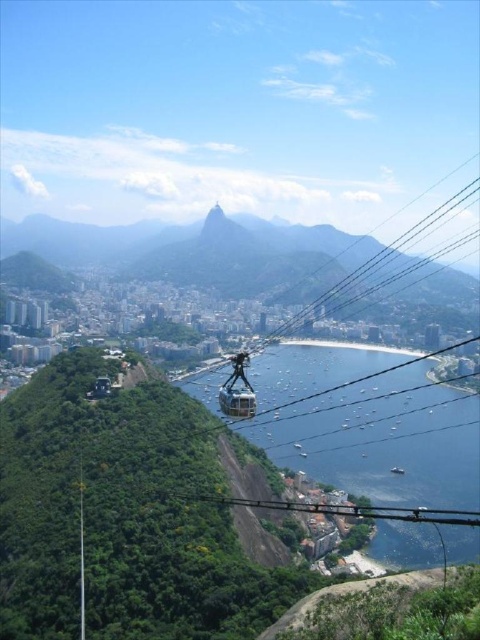
Does green grassy mountain at center have a lesser width compared to metallic cable car at center?

In fact, green grassy mountain at center might be wider than metallic cable car at center.

Is green grassy mountain at center positioned before metallic cable car at center?

No, green grassy mountain at center is behind metallic cable car at center.

In order to click on green grassy mountain at center in this screenshot , I will do `click(201, 252)`.

Identify the location of green grassy mountain at center. (201, 252).